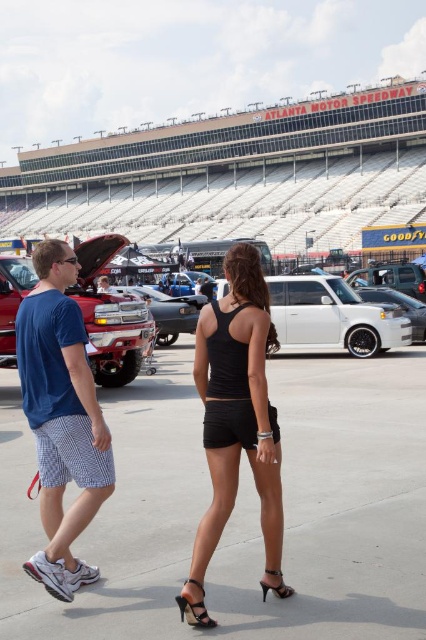
You are at the Atlanta Motor Speedway and want to locate the blue checkered shorts at left. According to the coordinates provided, where exactly would you look?

You should look at point 0.653 on the x axis and 0.146 on the y axis to find the blue checkered shorts at left.

You are standing at the Atlanta Motor Speedway and see two points marked in the image. Which point, point 1 at coordinates (x=184, y=605) or point 2 at coordinates (x=264, y=568), is closer to you?

Point 1 at coordinates (x=184, y=605) is closer to you because it is closer to the camera than point 2 at coordinates (x=264, y=568).